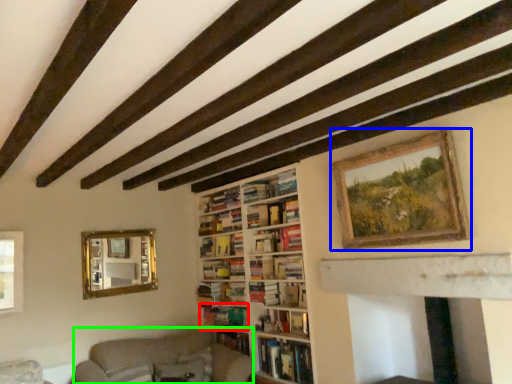
Question: Estimate the real-world distances between objects in this image. Which object is closer to book (highlighted by a red box), picture frame (highlighted by a blue box) or couch (highlighted by a green box)?

Choices:
 (A) picture frame
 (B) couch

Answer: (B)